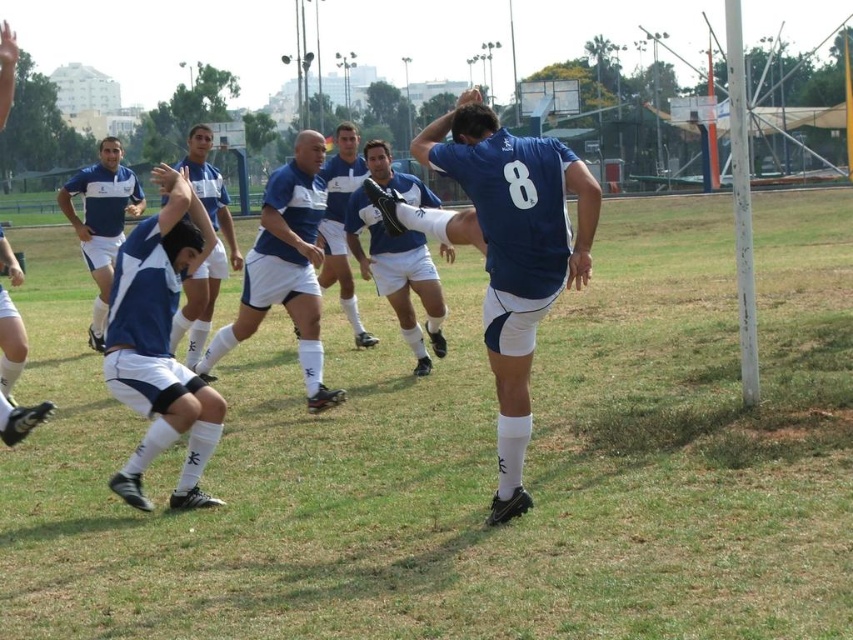
Consider the image. You are a soccer coach observing the field. You notice the green grass at center and the blue matte soccer player at center. Which object occupies more horizontal space in the image?

The green grass at center might be wider than blue matte soccer player at center, so the green grass at center occupies more horizontal space in the image.

You are a soccer coach analyzing the field. The point marked at coordinates (474, 461) is part of the field. Based on the scene description, what is located at that point?

The point at coordinates (474, 461) corresponds to green grass at center.